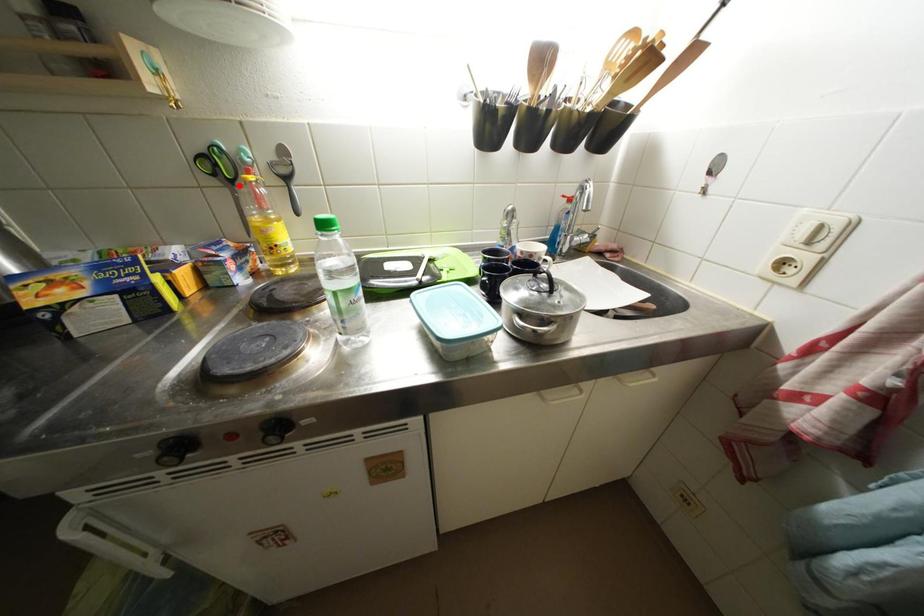
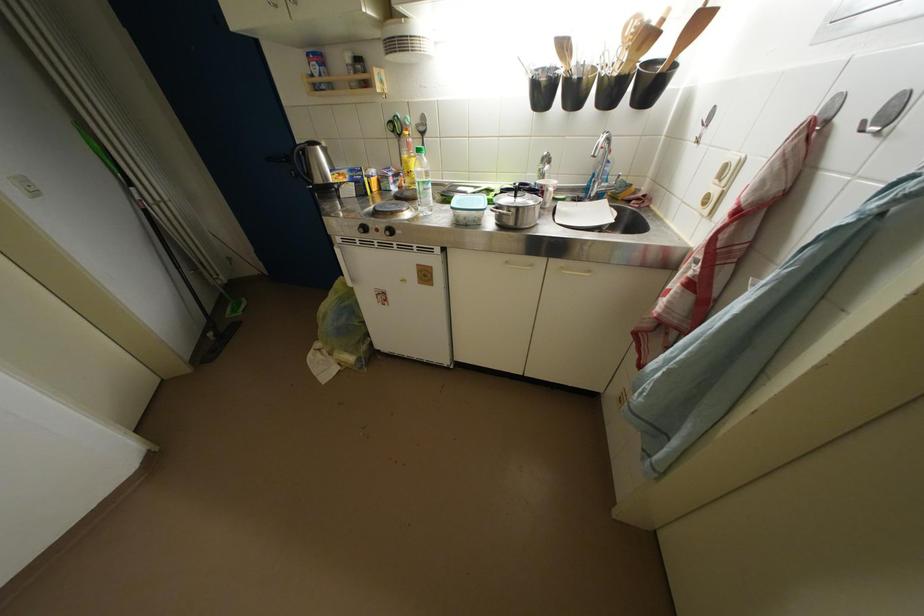
Where in the second image is the point corresponding to the highlighted location from the first image?

(407, 140)